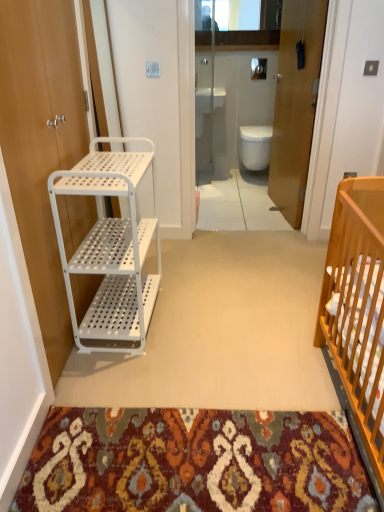
Identify the location of free space in front of white perforated shelving unit at left. This screenshot has width=384, height=512. (133, 381).